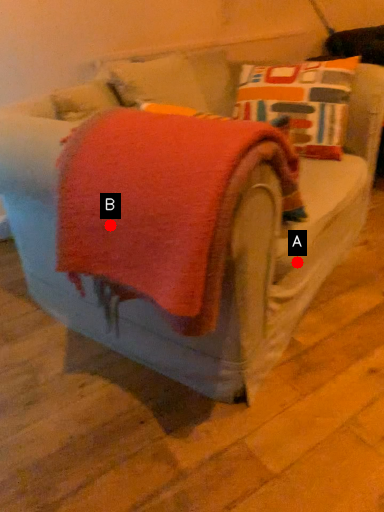
Question: Two points are circled on the image, labeled by A and B beside each circle. Which of the following is the farthest from the observer?

Choices:
 (A) A is further
 (B) B is further

Answer: (A)